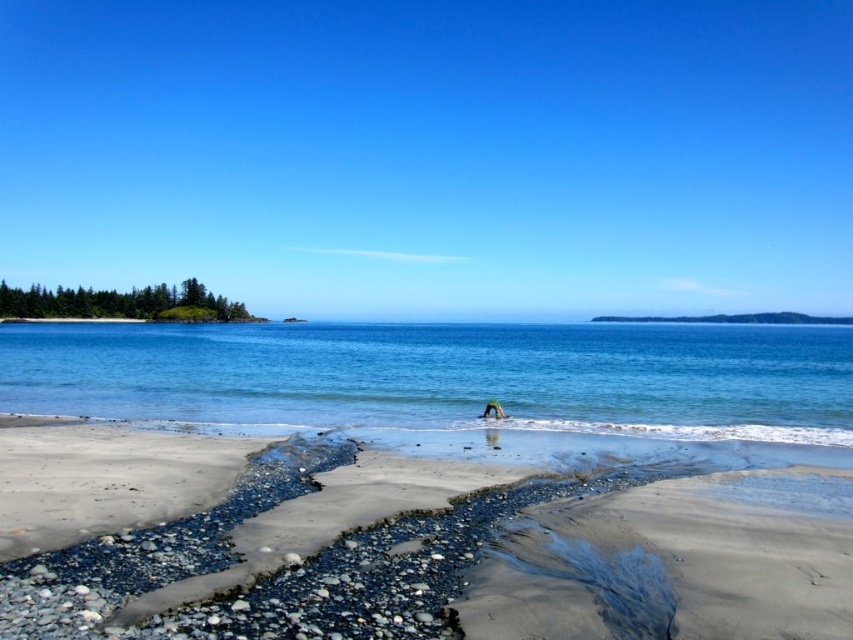
Is the position of smooth sand beach at center more distant than that of blue water at center?

No.

Is point (210, 582) less distant than point (778, 413)?

Yes, point (210, 582) is closer to viewer.

I want to click on smooth sand beach at center, so click(492, 561).

You are a GUI agent. You are given a task and a screenshot of the screen. Output one action in this format:
    pyautogui.click(x=<x>, y=<y>)
    Task: Click on the smooth sand beach at center
    This screenshot has height=640, width=853.
    Given the screenshot: What is the action you would take?
    pyautogui.click(x=492, y=561)

Does smooth sand beach at center appear under green fabric person at center?

Yes.

Between smooth sand beach at center and green fabric person at center, which one has more height?

With more height is green fabric person at center.

Locate an element on the screen. This screenshot has height=640, width=853. smooth sand beach at center is located at coordinates (492, 561).

Which is below, blue water at center or green fabric person at center?

green fabric person at center is below.

Identify the location of blue water at center. (445, 376).